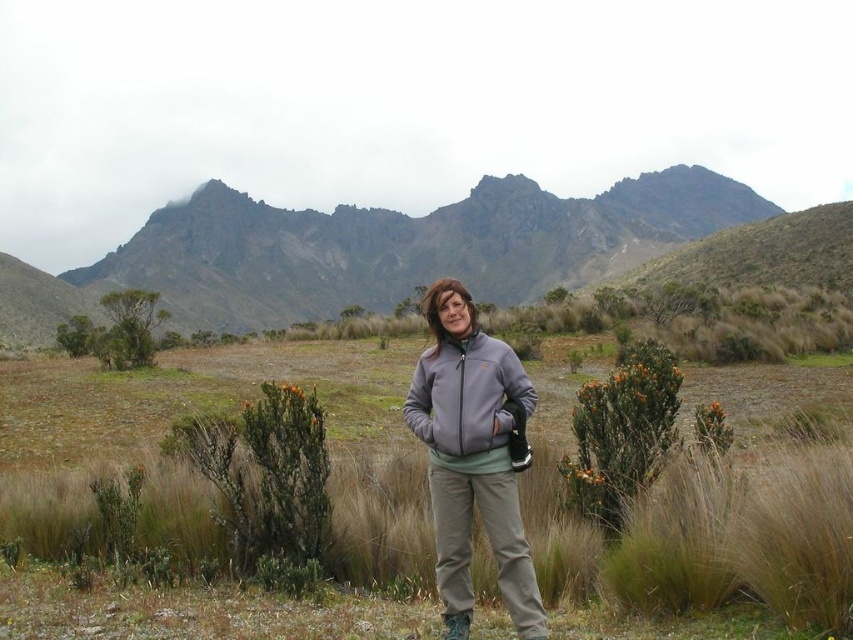
Question: Which object is the closest to the brown dry grass at center?

Choices:
 (A) gray fleece sweatshirt at center
 (B) gray fleece jacket at center

Answer: (B)

Question: Can you confirm if brown dry grass at center is positioned to the left of gray fleece jacket at center?

Choices:
 (A) no
 (B) yes

Answer: (B)

Question: Estimate the real-world distances between objects in this image. Which object is farther from the gray fleece jacket at center?

Choices:
 (A) gray fleece sweatshirt at center
 (B) brown dry grass at center

Answer: (B)

Question: Does brown dry grass at center appear on the left side of gray fleece sweatshirt at center?

Choices:
 (A) no
 (B) yes

Answer: (B)

Question: Among these objects, which one is nearest to the camera?

Choices:
 (A) gray fleece sweatshirt at center
 (B) gray fleece jacket at center

Answer: (B)

Question: Does brown dry grass at center have a smaller size compared to gray fleece jacket at center?

Choices:
 (A) no
 (B) yes

Answer: (A)